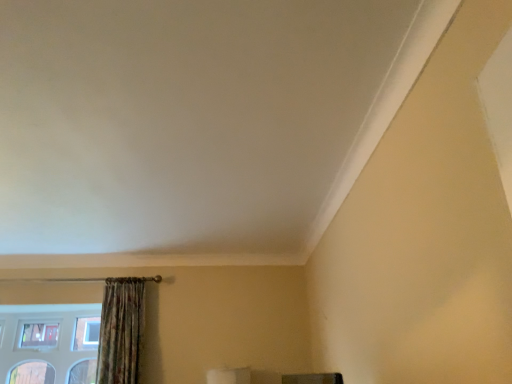
This screenshot has height=384, width=512. In order to click on floral fabric curtain at lower left in this screenshot , I will do `click(121, 331)`.

Describe the element at coordinates (121, 331) in the screenshot. I see `floral fabric curtain at lower left` at that location.

Locate an element on the screen. This screenshot has height=384, width=512. floral fabric curtain at lower left is located at coordinates (121, 331).